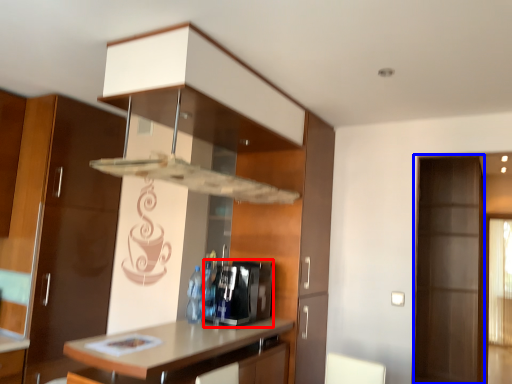
Question: Which object is further to the camera taking this photo, appliance (highlighted by a red box) or screen door (highlighted by a blue box)?

Choices:
 (A) appliance
 (B) screen door

Answer: (B)